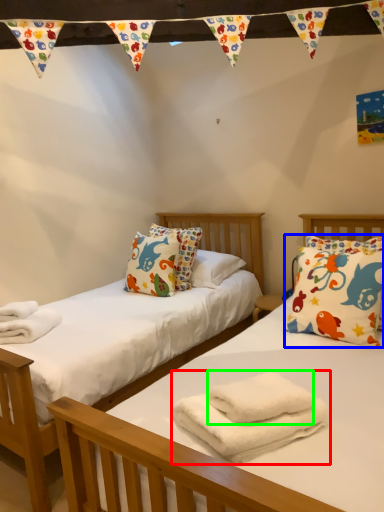
Question: Considering the real-world distances, which object is farthest from bath towel (highlighted by a red box)? pillow (highlighted by a blue box) or bath towel (highlighted by a green box)?

Choices:
 (A) pillow
 (B) bath towel

Answer: (A)